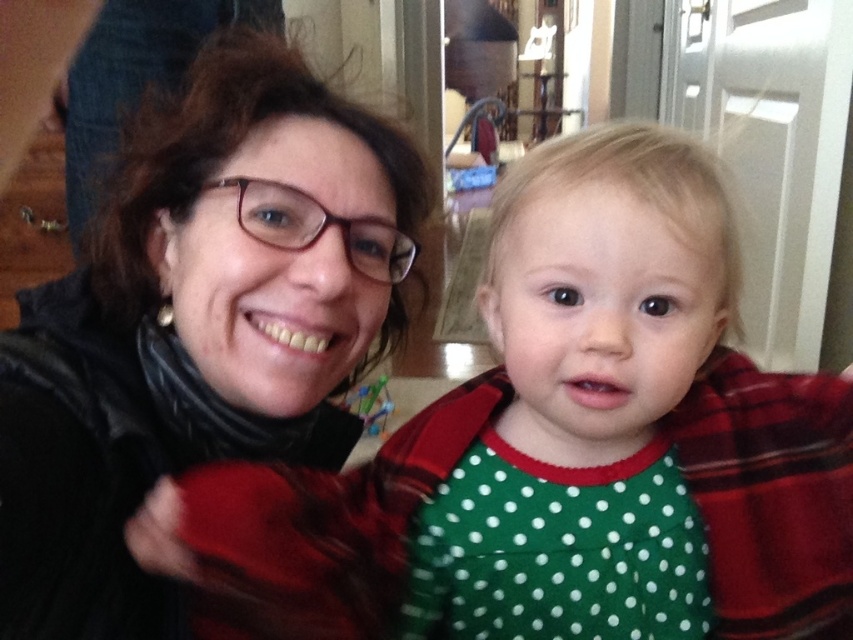
You are designing a new outfit and need to choose between the green dotted fabric at center and the matte black scarf at left. Which fabric has a greater width?

The green dotted fabric at center has a greater width than the matte black scarf at left.

Looking at the scene, which object has a smaller height between the green dotted fabric at center and the matte black scarf at left?

The green dotted fabric at center has a lesser height compared to the matte black scarf at left.